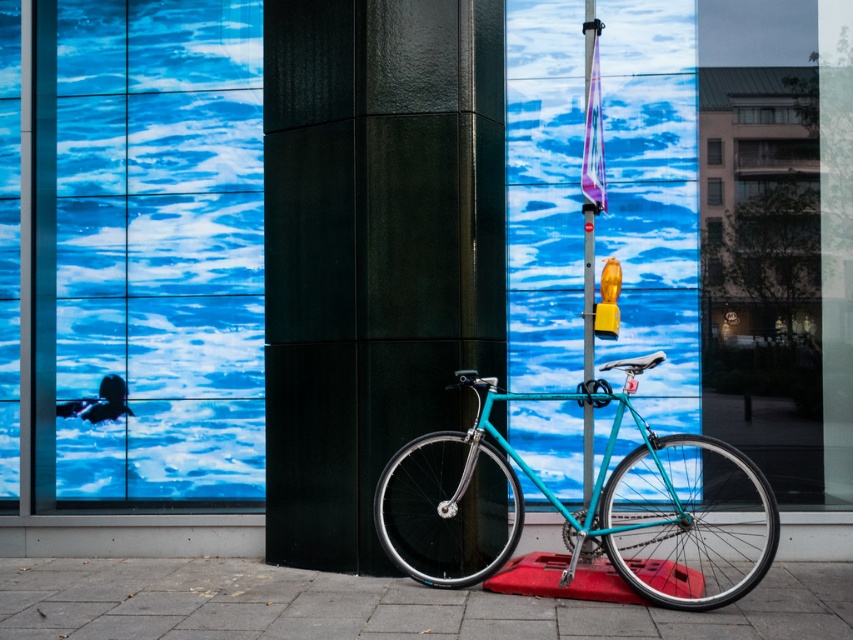
Does glossy black pillar at center come in front of teal matte bicycle at center?

No, glossy black pillar at center is further to the viewer.

Does glossy black pillar at center appear on the left side of teal matte bicycle at center?

Indeed, glossy black pillar at center is positioned on the left side of teal matte bicycle at center.

What do you see at coordinates (373, 250) in the screenshot? I see `glossy black pillar at center` at bounding box center [373, 250].

I want to click on glossy black pillar at center, so click(x=373, y=250).

Can you confirm if teal matte bicycle at center is taller than smooth concrete pavement at lower center?

Correct, teal matte bicycle at center is much taller as smooth concrete pavement at lower center.

Can you confirm if teal matte bicycle at center is positioned to the right of smooth concrete pavement at lower center?

Yes, teal matte bicycle at center is to the right of smooth concrete pavement at lower center.

The width and height of the screenshot is (853, 640). What do you see at coordinates (587, 506) in the screenshot?
I see `teal matte bicycle at center` at bounding box center [587, 506].

Locate an element on the screen. teal matte bicycle at center is located at coordinates (587, 506).

Who is positioned more to the right, glossy black pillar at center or smooth concrete pavement at lower center?

Positioned to the right is smooth concrete pavement at lower center.

Between glossy black pillar at center and smooth concrete pavement at lower center, which one has less height?

Standing shorter between the two is smooth concrete pavement at lower center.

Describe the element at coordinates (373, 250) in the screenshot. Image resolution: width=853 pixels, height=640 pixels. I see `glossy black pillar at center` at that location.

The width and height of the screenshot is (853, 640). In order to click on glossy black pillar at center in this screenshot , I will do point(373,250).